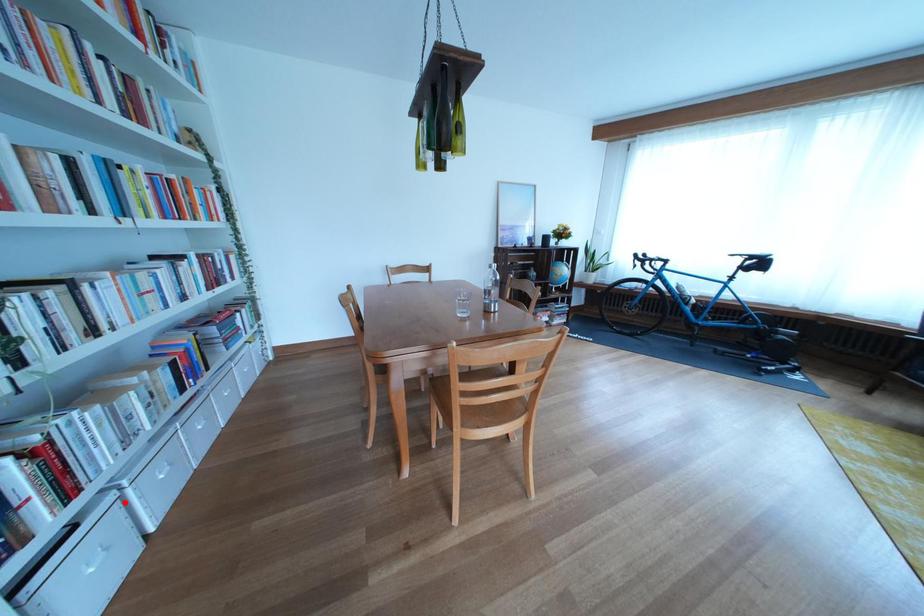
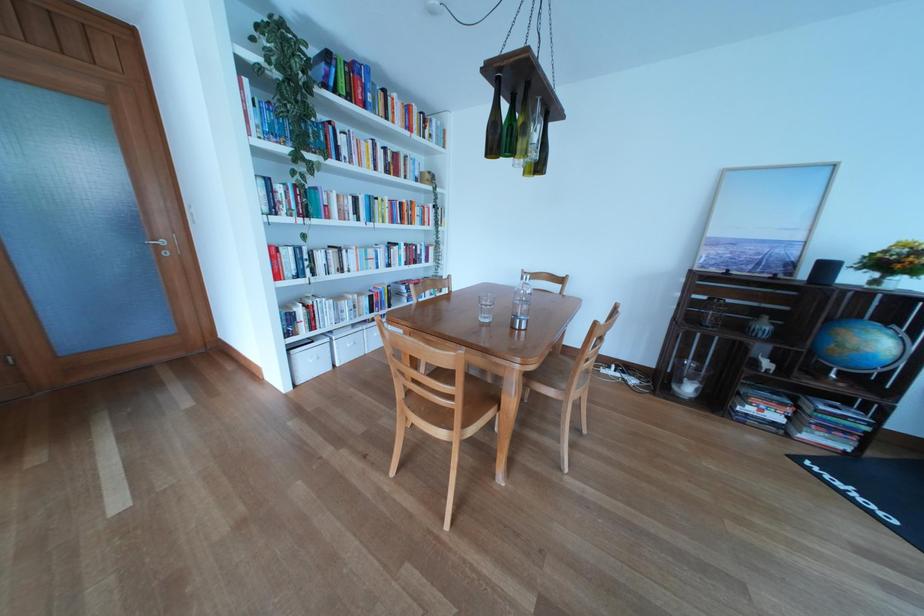
Question: I am providing you with two images of the same scene from different viewpoints. Given a red point in image1, look at the same physical point in image2. Is it:

Choices:
 (A) Closer to the viewpoint
 (B) Farther from the viewpoint

Answer: (A)